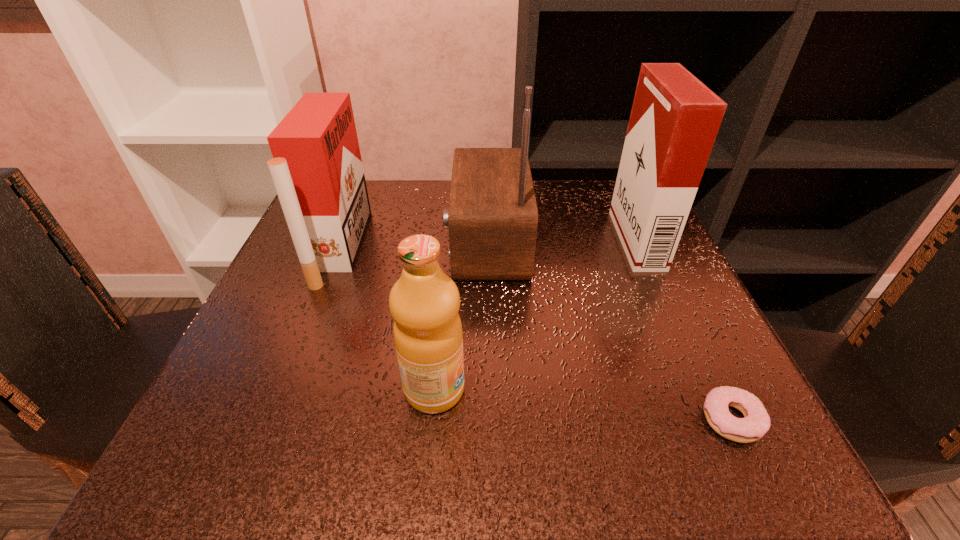
Find the location of a particular element. The height and width of the screenshot is (540, 960). free space located on the front-facing side of the taller cigarette case is located at coordinates (582, 240).

The width and height of the screenshot is (960, 540). I want to click on free space located 0.210m on the front-facing side of the taller cigarette case, so click(x=519, y=240).

At what (x,y) coordinates should I click in order to perform the action: click on free region located 0.290m on the front-facing side of the left cigarette case. Please return your answer as a coordinate pair (x, y). This screenshot has width=960, height=540. Looking at the image, I should click on (502, 248).

Locate an element on the screen. The width and height of the screenshot is (960, 540). free space located 0.210m on the front label of the fruit juice is located at coordinates (609, 389).

Locate an element on the screen. This screenshot has height=540, width=960. vacant space located 0.400m on the left of the shortest object is located at coordinates (412, 419).

Image resolution: width=960 pixels, height=540 pixels. Identify the location of radio receiver located in the far edge section of the desktop. (492, 218).

The height and width of the screenshot is (540, 960). I want to click on fruit juice present at the near edge, so click(x=424, y=302).

I want to click on doughnut that is at the near edge, so click(x=756, y=422).

At what (x,y) coordinates should I click in order to perform the action: click on object that is at the left edge. Please return your answer as a coordinate pair (x, y). The width and height of the screenshot is (960, 540). Looking at the image, I should click on (317, 170).

Locate an element on the screen. This screenshot has height=540, width=960. cigarette_case that is at the right edge is located at coordinates (675, 118).